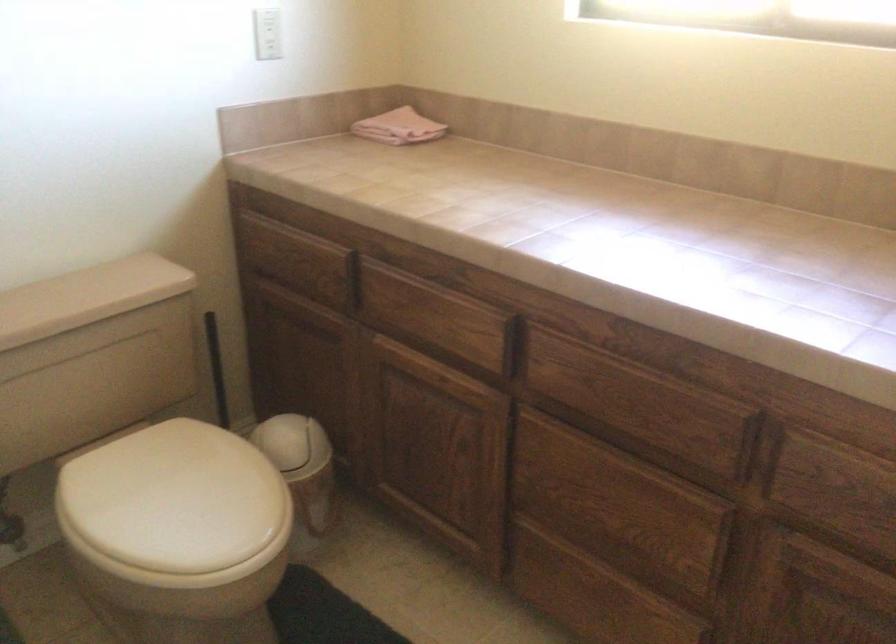
Where would you lift the beige toilet tank lid? Please return your answer as a coordinate pair (x, y).

(88, 297)